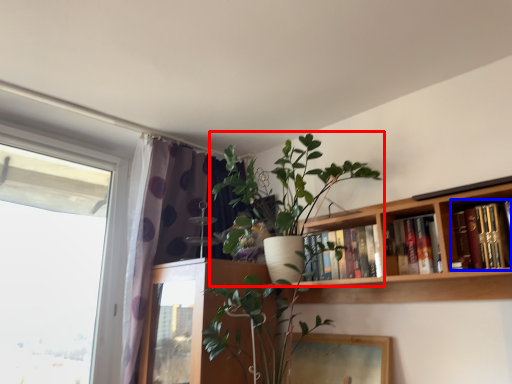
Question: Which point is closer to the camera, houseplant (highlighted by a red box) or book (highlighted by a blue box)?

Choices:
 (A) houseplant
 (B) book

Answer: (B)